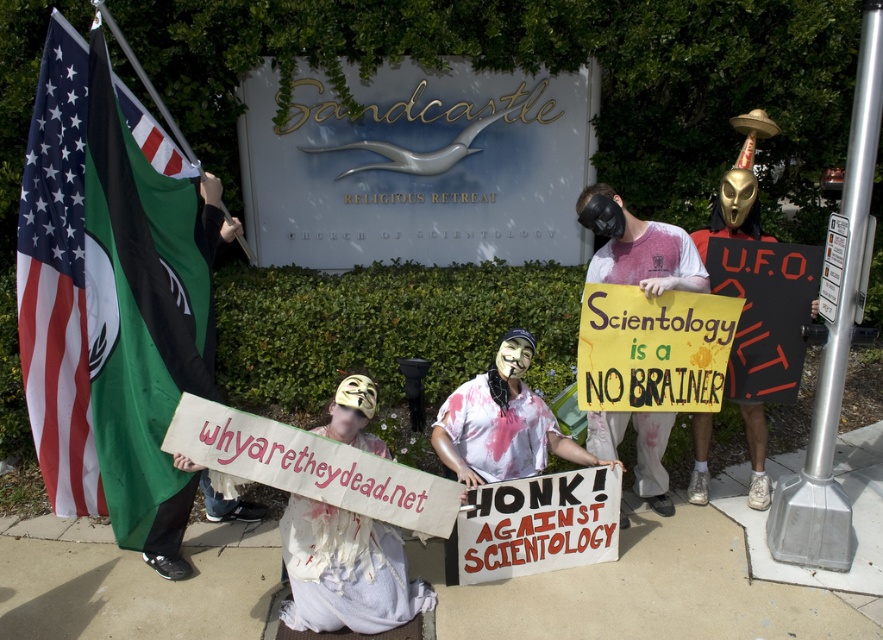
Question: Is american flag at left bigger than white cloth mask at center?

Choices:
 (A) no
 (B) yes

Answer: (B)

Question: Does white cloth mask at center appear under blood-stained t-shirt at center?

Choices:
 (A) no
 (B) yes

Answer: (B)

Question: Which point is farther to the camera?

Choices:
 (A) (157, 554)
 (B) (635, 248)
 (C) (479, 419)
 (D) (336, 616)

Answer: (C)

Question: Observing the image, what is the correct spatial positioning of blood-stained t-shirt at center in reference to white paper mask at center?

Choices:
 (A) above
 (B) below

Answer: (A)

Question: Among these objects, which one is nearest to the camera?

Choices:
 (A) american flag at left
 (B) white paper mask at center
 (C) blood-stained t-shirt at center
 (D) white cloth mask at center

Answer: (D)

Question: Which object appears closest to the camera in this image?

Choices:
 (A) white cloth mask at center
 (B) american flag at left
 (C) white paper mask at center
 (D) blood-stained t-shirt at center

Answer: (A)